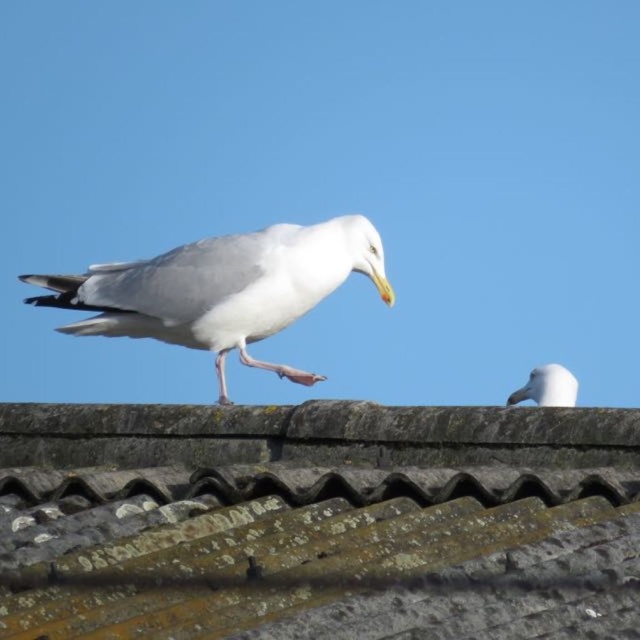
Is white matte bird at center thinner than white matte bird at upper center?

Incorrect, white matte bird at center's width is not less than white matte bird at upper center's.

Is point (275, 268) more distant than point (532, 384)?

No, it is not.

Which is behind, point (252, 362) or point (568, 401)?

The point (568, 401) is behind.

This screenshot has height=640, width=640. I want to click on white matte bird at center, so click(221, 289).

Who is higher up, rusty corrugated metal tiles at center or white matte bird at upper center?

rusty corrugated metal tiles at center

Which is behind, point (557, 528) or point (552, 380)?

The point (552, 380) is more distant.

This screenshot has width=640, height=640. I want to click on rusty corrugated metal tiles at center, so click(x=317, y=518).

Who is higher up, rusty corrugated metal tiles at center or white matte bird at center?

white matte bird at center is above.

Which is in front, point (74, 614) or point (240, 323)?

Point (74, 614) is in front.

Locate an element on the screen. Image resolution: width=640 pixels, height=640 pixels. rusty corrugated metal tiles at center is located at coordinates (317, 518).

This screenshot has height=640, width=640. What are the coordinates of `rusty corrugated metal tiles at center` in the screenshot? It's located at (317, 518).